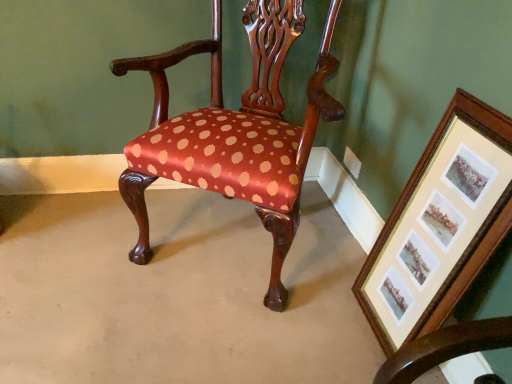
I want to click on vacant area to the left of satin fabric chair at center, so click(78, 247).